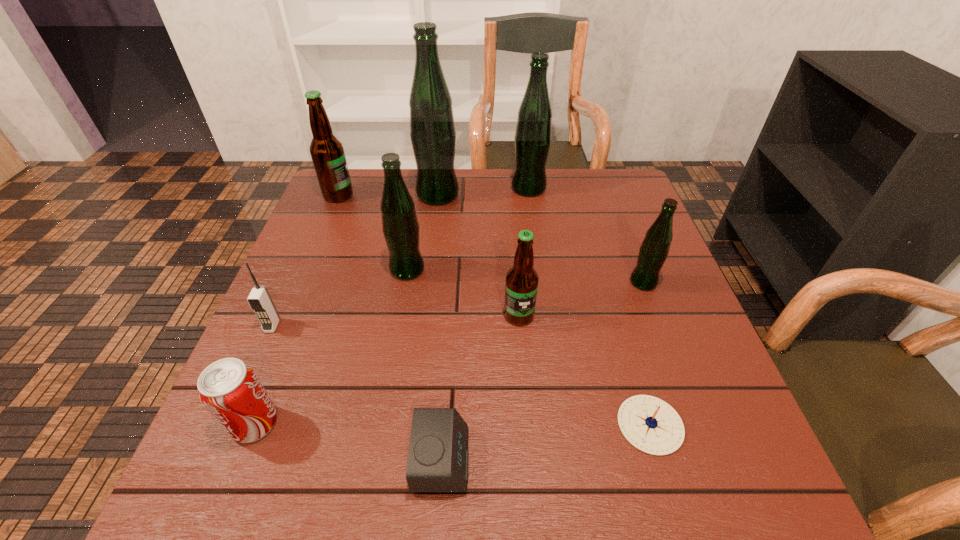
Where is `vacant region located 0.370m on the label of the leftmost beer bottle`? The width and height of the screenshot is (960, 540). vacant region located 0.370m on the label of the leftmost beer bottle is located at coordinates (480, 195).

This screenshot has width=960, height=540. In order to click on vacant area situated on the left of the third biggest green beer bottle in this screenshot , I will do `click(306, 269)`.

What are the coordinates of `vacant space located 0.360m on the label of the right brown beer bottle` in the screenshot? It's located at (535, 510).

At what (x,y) coordinates should I click in order to perform the action: click on free location located on the front of the rightmost beer bottle. Please return your answer as a coordinate pair (x, y). Looking at the image, I should click on (660, 329).

Find the location of a particular element. vacant area situated on the front-facing side of the cellular telephone is located at coordinates (260, 353).

This screenshot has width=960, height=540. Find the location of `blank area located 0.290m on the right of the soda can`. blank area located 0.290m on the right of the soda can is located at coordinates 443,423.

Find the location of a particular element. This screenshot has height=540, width=960. free space located on the front-facing side of the second shortest object is located at coordinates (529, 460).

Where is `vacant region located on the left of the shortest object`? The height and width of the screenshot is (540, 960). vacant region located on the left of the shortest object is located at coordinates (555, 425).

What are the coordinates of `alarm clock that is at the near edge` in the screenshot? It's located at (438, 458).

The width and height of the screenshot is (960, 540). I want to click on compass that is at the near edge, so click(x=650, y=424).